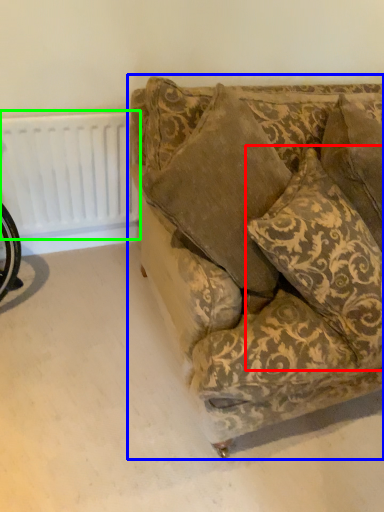
Question: Based on their relative distances, which object is farther from throw pillow (highlighted by a red box)? Choose from studio couch (highlighted by a blue box) and radiator (highlighted by a green box).

Choices:
 (A) studio couch
 (B) radiator

Answer: (B)